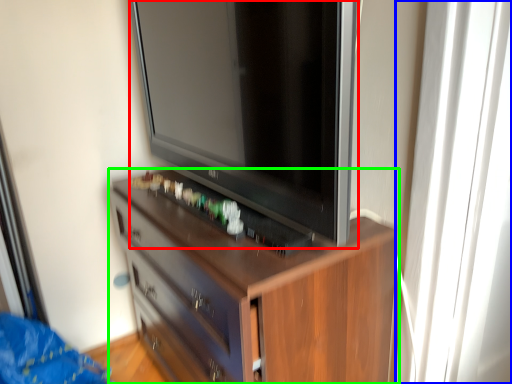
Question: Which is farther away from television (highlighted by a red box)? glass door (highlighted by a blue box) or chest of drawers (highlighted by a green box)?

Choices:
 (A) glass door
 (B) chest of drawers

Answer: (A)